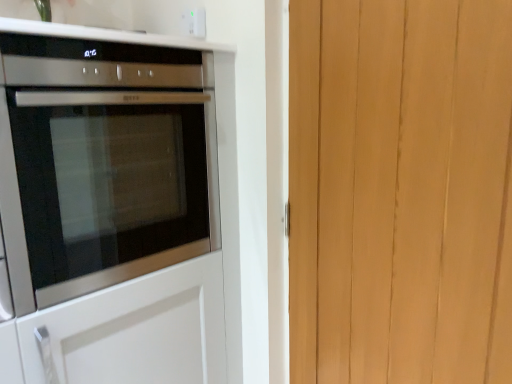
Question: Relative to light brown wood at right, is satin silver oven at left in front or behind?

Choices:
 (A) front
 (B) behind

Answer: (B)

Question: Considering the positions of point (96, 109) and point (446, 322), is point (96, 109) closer or farther from the camera than point (446, 322)?

Choices:
 (A) farther
 (B) closer

Answer: (A)

Question: Estimate the real-world distances between objects in this image. Which object is farther from the white plastic electric outlet at upper center?

Choices:
 (A) light brown wood at right
 (B) satin silver oven at left

Answer: (A)

Question: Which of these objects is positioned farthest from the light brown wood at right?

Choices:
 (A) satin silver oven at left
 (B) white plastic electric outlet at upper center

Answer: (B)